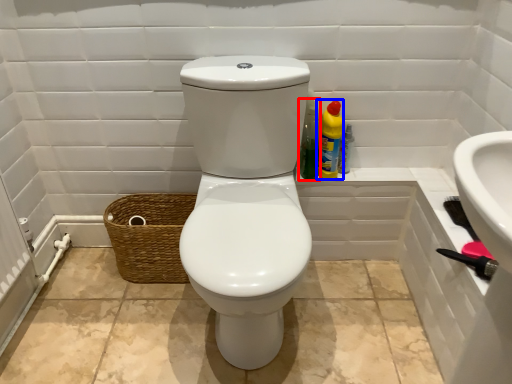
Question: Among these objects, which one is nearest to the camera, cleaning product (highlighted by a red box) or cleaning product (highlighted by a blue box)?

Choices:
 (A) cleaning product
 (B) cleaning product

Answer: (A)